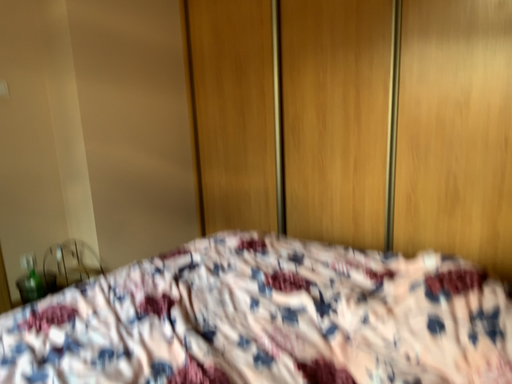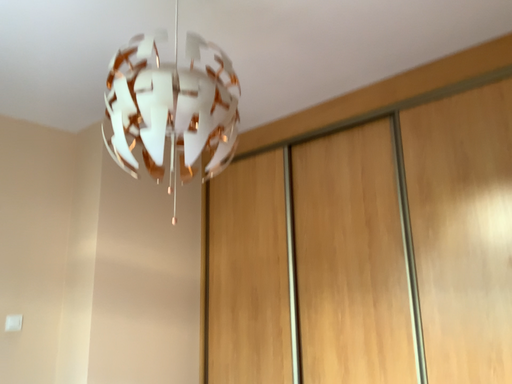
Question: How did the camera likely rotate when shooting the video?

Choices:
 (A) rotated upward
 (B) rotated downward

Answer: (A)